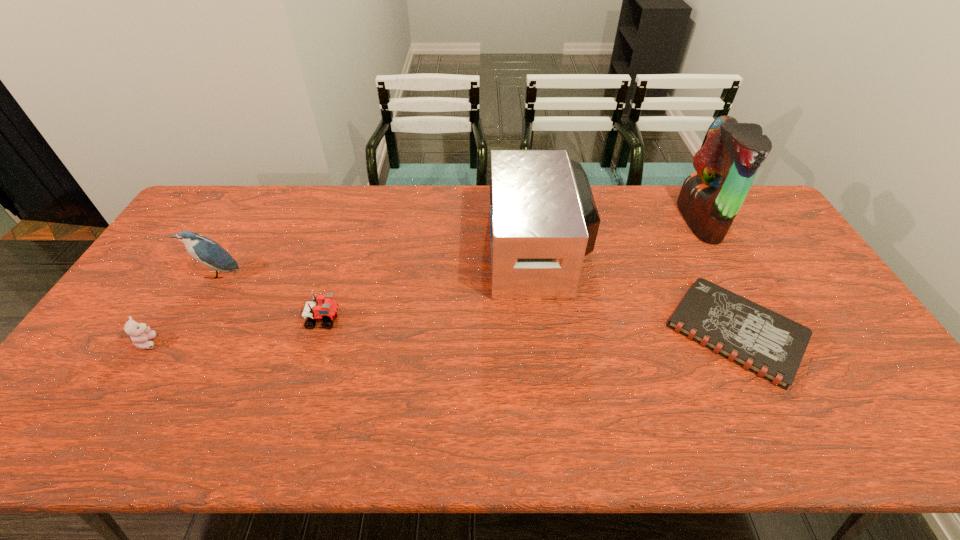
You are a GUI agent. You are given a task and a screenshot of the screen. Output one action in this format:
    pyautogui.click(x=<x>, y=<y>)
    Task: Click on the tallest object
    
    Given the screenshot: What is the action you would take?
    pyautogui.click(x=710, y=198)

The image size is (960, 540). I want to click on the fourth object from left to right, so coord(543,218).

At what (x,y) coordinates should I click in order to perform the action: click on the fifth shortest object. Please return your answer as a coordinate pair (x, y). Image resolution: width=960 pixels, height=540 pixels. Looking at the image, I should click on (543, 218).

Locate an element on the screen. The image size is (960, 540). the fourth shortest object is located at coordinates (206, 251).

The image size is (960, 540). What are the coordinates of `Lego` in the screenshot? It's located at (323, 308).

Find the location of a particular element. teddy bear is located at coordinates (140, 334).

Locate an element on the screen. the shortest object is located at coordinates (772, 346).

Where is `free region located 0.060m at the face of the parrot`? This screenshot has height=540, width=960. free region located 0.060m at the face of the parrot is located at coordinates point(664,221).

Find the location of a particular element. Image resolution: width=960 pixels, height=540 pixels. vacant area located 0.260m at the face of the parrot is located at coordinates (606, 221).

Find the location of a particular element. free space located at the face of the parrot is located at coordinates (664, 221).